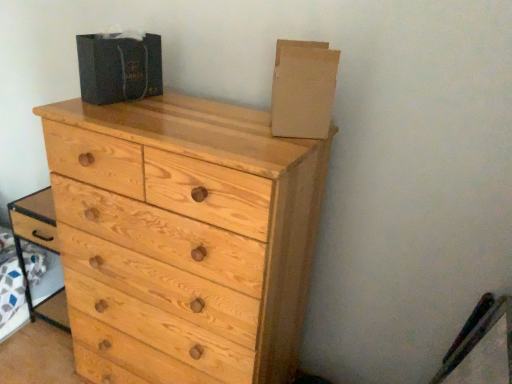
The image size is (512, 384). Identify the location of vacant region under dark gray cardboard box at upper center, positioned as the 1th cardboard box in left-to-right order (from a real-world perspective). coord(126,92).